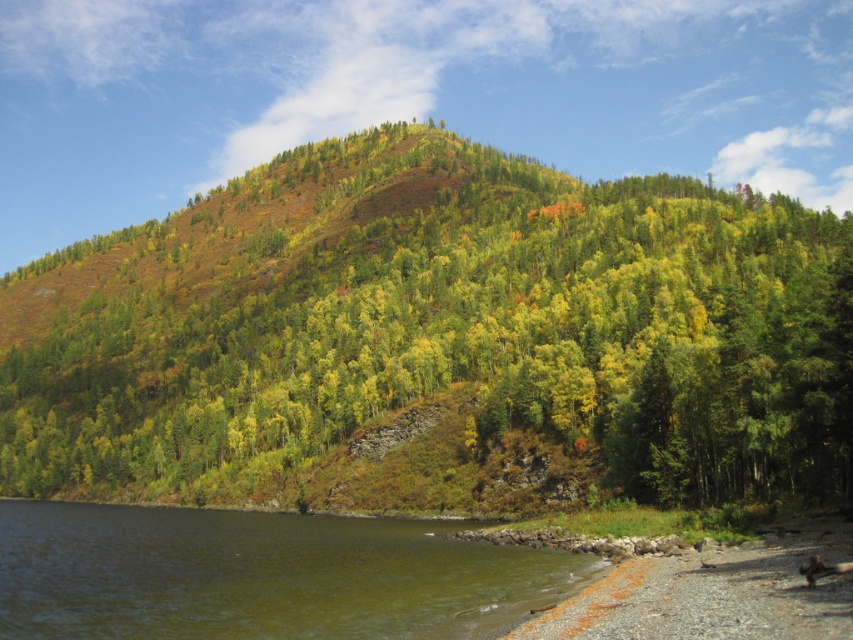
Question: Is green leafy trees at center below greenish water at lower left?

Choices:
 (A) yes
 (B) no

Answer: (B)

Question: Is the position of green leafy trees at center less distant than that of greenish water at lower left?

Choices:
 (A) no
 (B) yes

Answer: (A)

Question: Which point appears closest to the camera in this image?

Choices:
 (A) (380, 481)
 (B) (495, 614)

Answer: (B)

Question: Which object appears closest to the camera in this image?

Choices:
 (A) greenish water at lower left
 (B) green leafy trees at center

Answer: (A)

Question: Can you confirm if green leafy trees at center is positioned above greenish water at lower left?

Choices:
 (A) no
 (B) yes

Answer: (B)